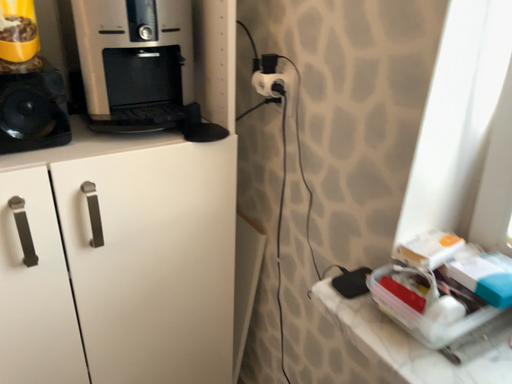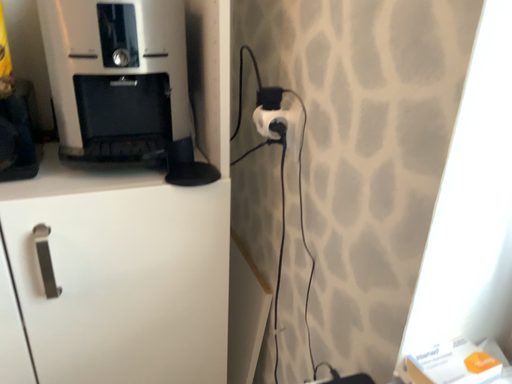
Question: Which way did the camera rotate in the video?

Choices:
 (A) rotated right
 (B) rotated left

Answer: (B)